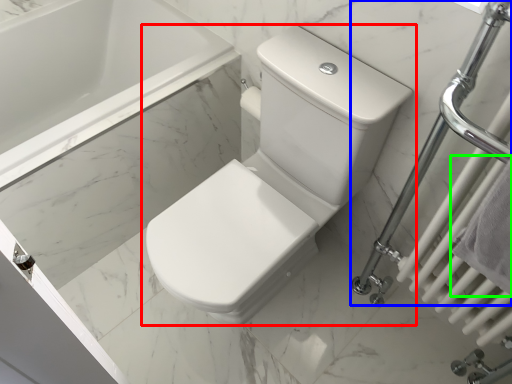
Question: Estimate the real-world distances between objects in this image. Which object is closer to toilet (highlighted by a red box), shower (highlighted by a blue box) or bath towel (highlighted by a green box)?

Choices:
 (A) shower
 (B) bath towel

Answer: (A)